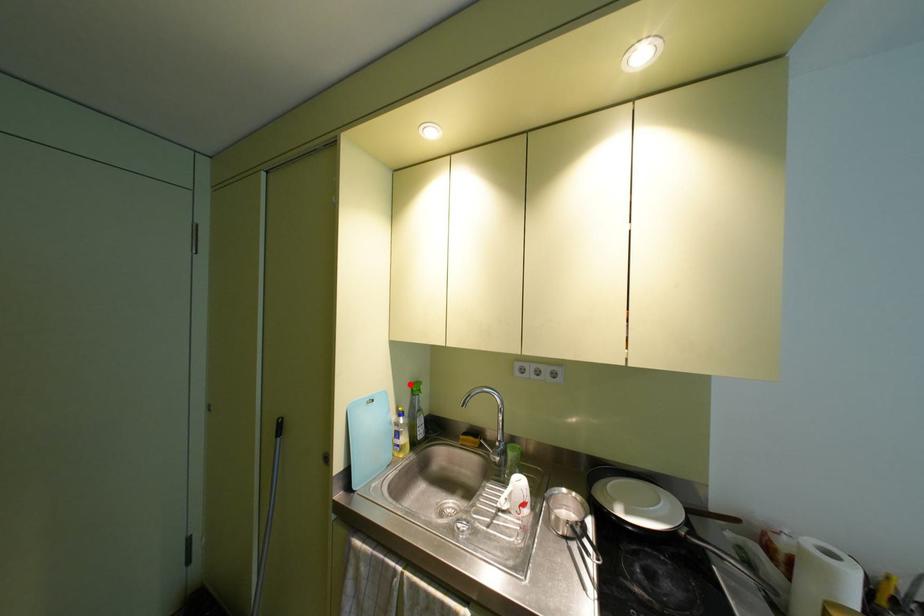
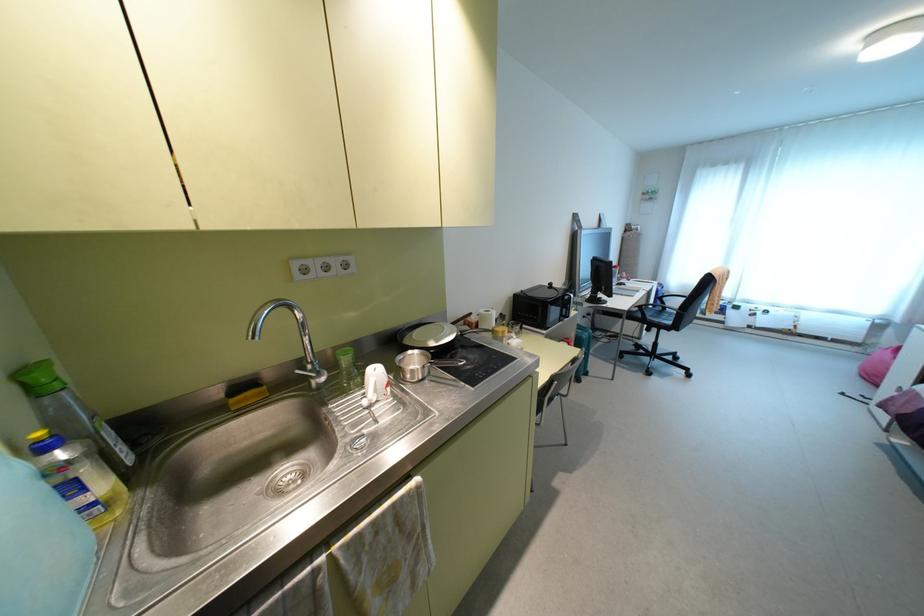
Question: I am providing you with two images of the same scene from different viewpoints. A red point is marked on the first image. Is the red point's position out of view in image 2?

Choices:
 (A) Yes
 (B) No

Answer: (B)